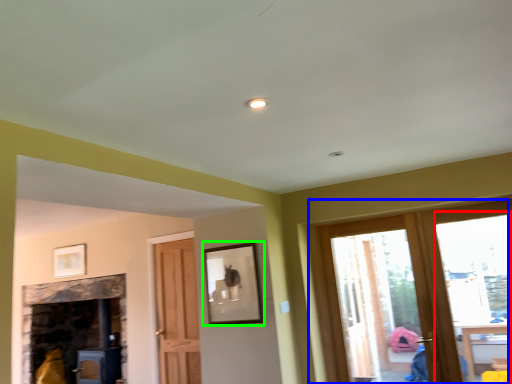
Question: Considering the real-world distances, which object is farthest from window (highlighted by a red box)? window (highlighted by a blue box) or picture frame (highlighted by a green box)?

Choices:
 (A) window
 (B) picture frame

Answer: (A)